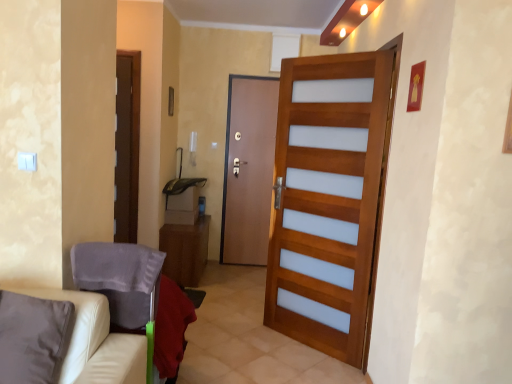
This screenshot has height=384, width=512. In order to click on vacant space in front of brown wooden door at center, the 1th door viewed from the back in this screenshot , I will do `click(237, 269)`.